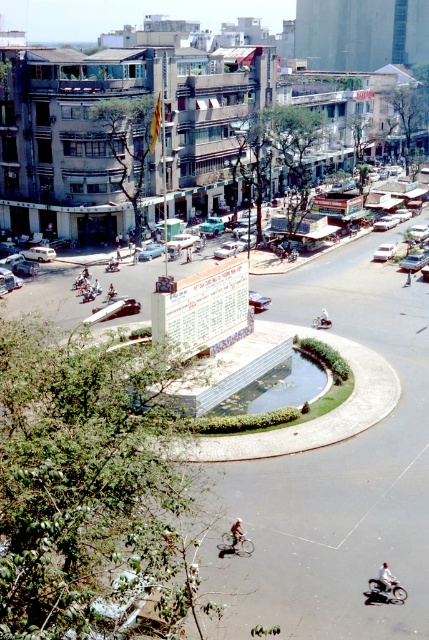
You are standing at the center of the roundabout and want to find the silver metallic bicycle at center. In which direction should you look relative to your current position?

The silver metallic bicycle at center is located at point (235, 544), which is to the right of the center point. Therefore, you should look to your right to find it.

Consider the image. You are a pedestrian standing at the roundabout in the center of the city. You see two points marked on the ground. The first point is at coordinates point [384,588] and the second point is at point [247,540]. Which point is closer to you?

Point [384,588] is in front of point [247,540], so the first point is closer to you.

In the scene shown: You are a delivery person needing to cross the street from the metallic silver car at center to the white plastic bicycle at center. Considering the traffic light is green for pedestrians, can you safely walk this distance in 15 seconds?

The distance between the metallic silver car at center and the white plastic bicycle at center is 10.86 meters. At an average walking speed of 1.4 meters per second, it would take approximately 7.76 seconds to cover this distance. Since the traffic light is green and the time required is less than 15 seconds, you can safely cross.